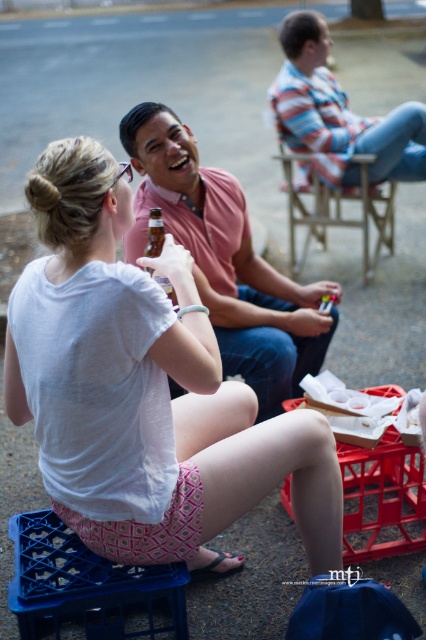
Question: Which point is farther to the camera?

Choices:
 (A) (154, 253)
 (B) (377, 195)
 (C) (400, 544)
 (D) (216, 193)

Answer: (B)

Question: Is striped cotton shirt at upper right closer to the viewer compared to brown glass bottle at center?

Choices:
 (A) no
 (B) yes

Answer: (A)

Question: Which object is positioned closest to the wooden chair at center?

Choices:
 (A) red plastic crate at lower center
 (B) brown glass bottle at center

Answer: (A)

Question: Which point is farther to the camera?

Choices:
 (A) (370, 272)
 (B) (235, 394)
 (C) (412, 456)
 (D) (143, 196)

Answer: (A)

Question: Does striped cotton shirt at upper right appear on the right side of brown glass bottle at center?

Choices:
 (A) yes
 (B) no

Answer: (A)

Question: From the image, what is the correct spatial relationship of striped cotton shirt at upper right in relation to wooden chair at center?

Choices:
 (A) below
 (B) above

Answer: (B)